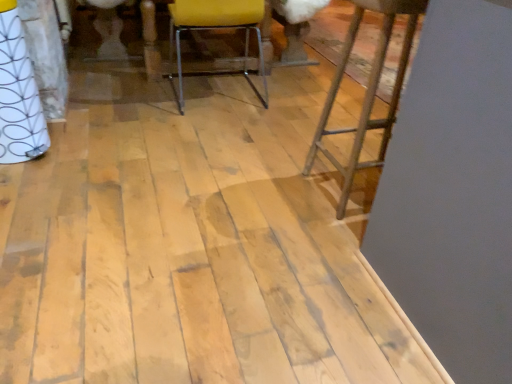
Question: Considering the relative sizes of rustic wood stool at right and yellow fabric chair at center in the image provided, is rustic wood stool at right thinner than yellow fabric chair at center?

Choices:
 (A) no
 (B) yes

Answer: (B)

Question: Considering the relative positions of rustic wood stool at right and yellow fabric chair at center in the image provided, is rustic wood stool at right behind yellow fabric chair at center?

Choices:
 (A) no
 (B) yes

Answer: (A)

Question: From the image's perspective, does rustic wood stool at right appear higher than yellow fabric chair at center?

Choices:
 (A) yes
 (B) no

Answer: (B)

Question: Considering the relative positions of rustic wood stool at right and yellow fabric chair at center in the image provided, is rustic wood stool at right in front of yellow fabric chair at center?

Choices:
 (A) yes
 (B) no

Answer: (A)

Question: Is rustic wood stool at right looking in the opposite direction of yellow fabric chair at center?

Choices:
 (A) no
 (B) yes

Answer: (B)

Question: Does rustic wood stool at right appear on the right side of yellow fabric chair at center?

Choices:
 (A) no
 (B) yes

Answer: (B)

Question: Considering the relative positions of yellow fabric chair at center and rustic wood stool at right in the image provided, is yellow fabric chair at center in front of rustic wood stool at right?

Choices:
 (A) yes
 (B) no

Answer: (B)

Question: Can you confirm if yellow fabric chair at center is wider than rustic wood stool at right?

Choices:
 (A) no
 (B) yes

Answer: (B)

Question: Does yellow fabric chair at center have a larger size compared to rustic wood stool at right?

Choices:
 (A) yes
 (B) no

Answer: (A)

Question: Is yellow fabric chair at center shorter than rustic wood stool at right?

Choices:
 (A) yes
 (B) no

Answer: (A)

Question: From the image's perspective, is yellow fabric chair at center below rustic wood stool at right?

Choices:
 (A) yes
 (B) no

Answer: (B)

Question: Considering the relative sizes of yellow fabric chair at center and rustic wood stool at right in the image provided, is yellow fabric chair at center taller than rustic wood stool at right?

Choices:
 (A) no
 (B) yes

Answer: (A)

Question: From a real-world perspective, is yellow fabric chair at center above or below rustic wood stool at right?

Choices:
 (A) below
 (B) above

Answer: (A)